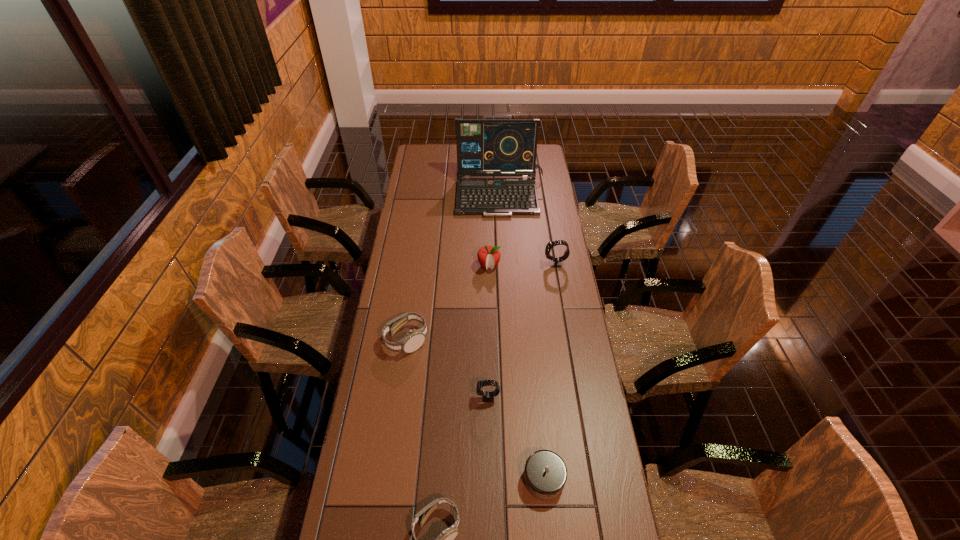
Image resolution: width=960 pixels, height=540 pixels. In order to click on the third closest gray watch relative to the chocolate cake in this screenshot , I will do `click(0, 0)`.

I want to click on white watch identified as the closest to the seventh farthest object, so pyautogui.click(x=0, y=0).

The width and height of the screenshot is (960, 540). I want to click on white watch that is the second closest to the third nearest object, so click(0, 0).